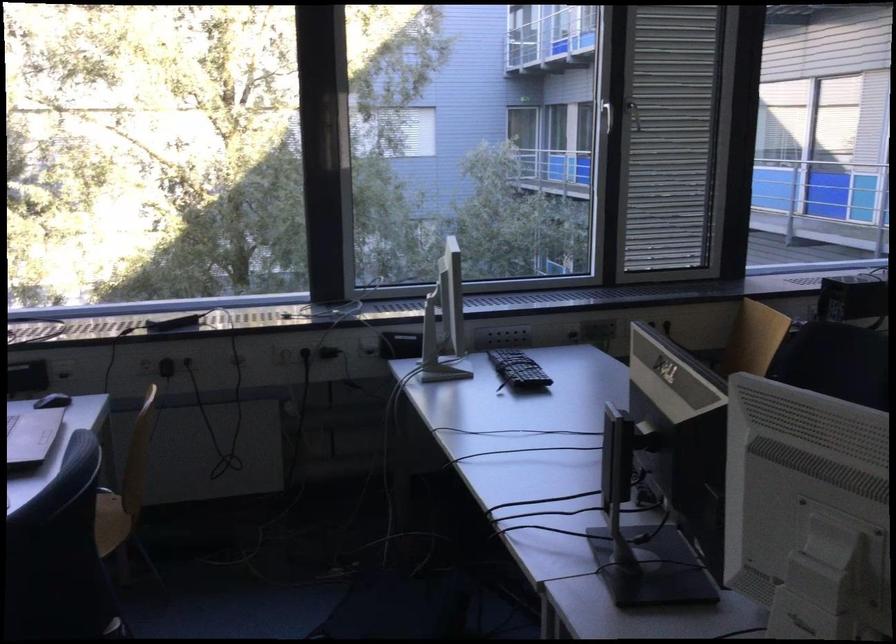
Image resolution: width=896 pixels, height=644 pixels. What do you see at coordinates (606, 114) in the screenshot? I see `a silver window handle` at bounding box center [606, 114].